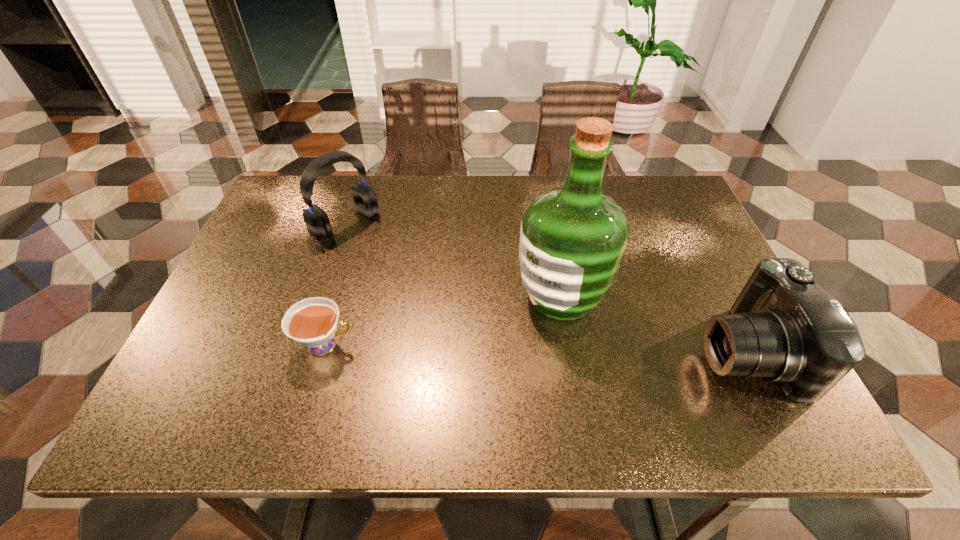
Where is `object present at the left edge`? The height and width of the screenshot is (540, 960). object present at the left edge is located at coordinates (317, 221).

Find the location of a particular element. This screenshot has width=960, height=540. object located at the right edge is located at coordinates (784, 328).

Identify the location of object that is at the far left corner. (317, 221).

The width and height of the screenshot is (960, 540). I want to click on object that is positioned at the near right corner, so click(784, 328).

Locate an element on the screen. Image resolution: width=960 pixels, height=540 pixels. vacant space at the far edge of the desktop is located at coordinates (522, 197).

The image size is (960, 540). What are the coordinates of `vacant space at the near edge of the desktop` in the screenshot? It's located at (585, 384).

This screenshot has width=960, height=540. I want to click on vacant space at the left edge of the desktop, so click(x=271, y=262).

The width and height of the screenshot is (960, 540). What are the coordinates of `vacant point at the right edge` in the screenshot? It's located at (702, 318).

This screenshot has height=540, width=960. I want to click on blank space at the far left corner of the desktop, so click(325, 193).

In order to click on vacant space at the near left corner in this screenshot , I will do `click(206, 389)`.